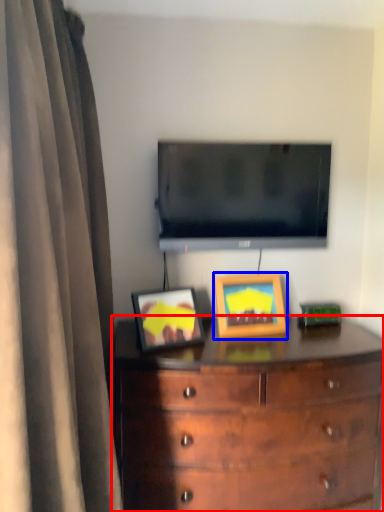
Question: Which of the following is the farthest to the observer, chest of drawers (highlighted by a red box) or picture frame (highlighted by a blue box)?

Choices:
 (A) chest of drawers
 (B) picture frame

Answer: (B)